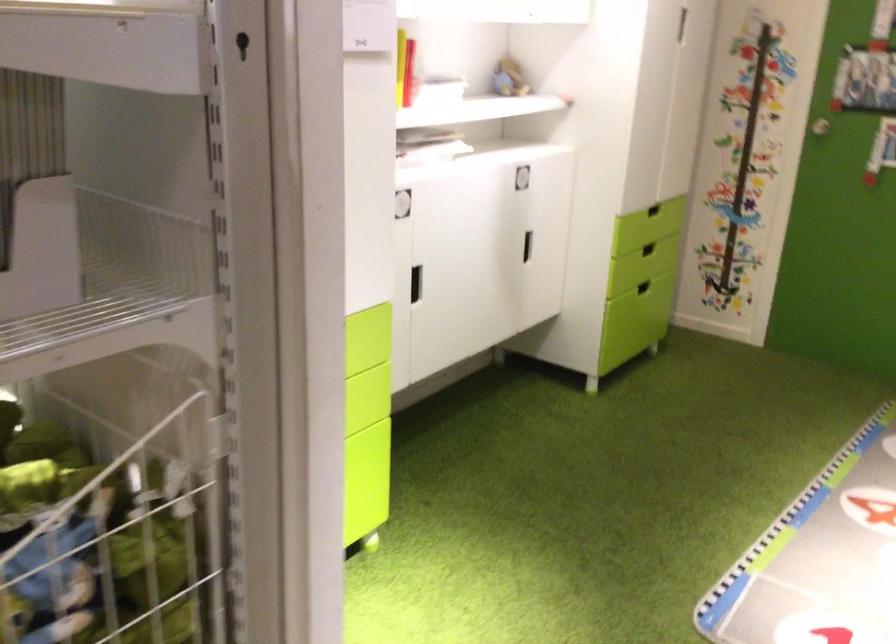
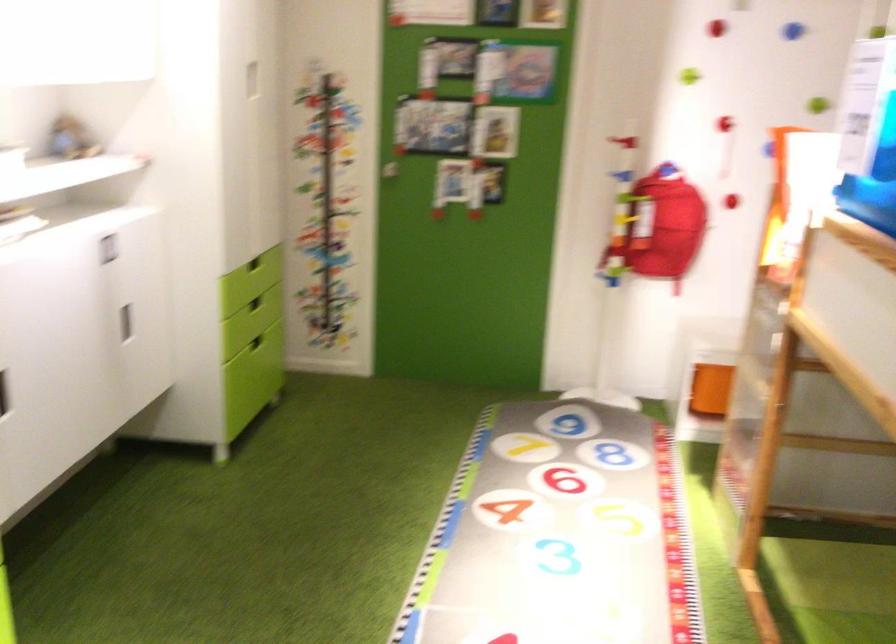
Locate, in the second image, the point that corresponds to point 652,245 in the first image.

(254, 303)